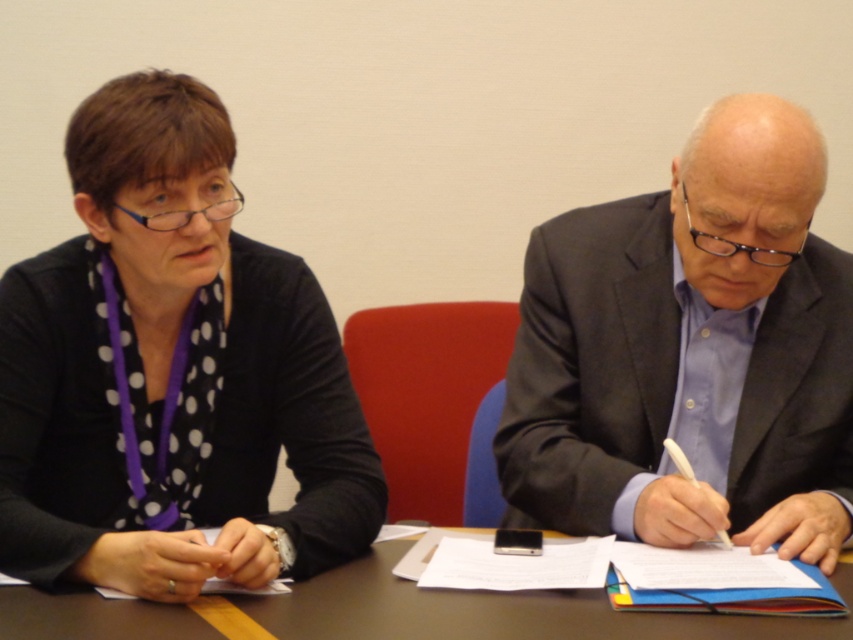
You are standing in front of the table where the two people are sitting. There are two points marked on the table surface. One is at coordinates point (132, 317) and the other is at point (569, 628). Which point is closer to you?

Point (132, 317) is closer to you because it is further to the viewer than point (569, 628).